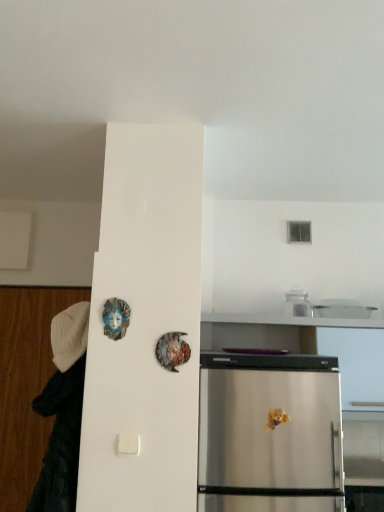
The width and height of the screenshot is (384, 512). What do you see at coordinates (63, 412) in the screenshot? I see `white fabric at left` at bounding box center [63, 412].

Identify the location of white fabric at left. (63, 412).

Image resolution: width=384 pixels, height=512 pixels. What do you see at coordinates (172, 350) in the screenshot? I see `shiny metallic mask at center` at bounding box center [172, 350].

Identify the location of shiny metallic mask at center. (172, 350).

In order to face shiny metallic mask at center, should I rotate leftwards or rightwards?

It's best to rotate left around 2.602 degrees.

Where is `white fabric at left`? white fabric at left is located at coordinates (63, 412).

Which object is positioned more to the left, shiny metallic mask at center or white fabric at left?

From the viewer's perspective, white fabric at left appears more on the left side.

Is shiny metallic mask at center further to the viewer compared to white fabric at left?

No.

Which is behind, point (186, 352) or point (57, 393)?

The point (57, 393) is behind.

From the image's perspective, between shiny metallic mask at center and white fabric at left, who is located below?

white fabric at left is shown below in the image.

From a real-world perspective, relative to white fabric at left, is shiny metallic mask at center vertically above or below?

shiny metallic mask at center is situated higher than white fabric at left in the real world.

Considering the relative sizes of shiny metallic mask at center and white fabric at left in the image provided, is shiny metallic mask at center wider than white fabric at left?

No, shiny metallic mask at center is not wider than white fabric at left.

Is shiny metallic mask at center shorter than white fabric at left?

Yes, shiny metallic mask at center is shorter than white fabric at left.

Does shiny metallic mask at center have a larger size compared to white fabric at left?

Actually, shiny metallic mask at center might be smaller than white fabric at left.

Would you say white fabric at left is part of shiny metallic mask at center's contents?

No, white fabric at left is not surrounded by shiny metallic mask at center.

Is shiny metallic mask at center directly adjacent to white fabric at left?

There is a gap between shiny metallic mask at center and white fabric at left.

Based on the photo, could you tell me if shiny metallic mask at center is facing white fabric at left?

No, shiny metallic mask at center is not turned towards white fabric at left.

Measure the distance between shiny metallic mask at center and white fabric at left.

shiny metallic mask at center is 17.33 inches from white fabric at left.

Identify the location of couple that is below the shiny metallic mask at center (from the image's perspective). (63, 412).

Between white fabric at left and shiny metallic mask at center, which one appears on the right side from the viewer's perspective?

shiny metallic mask at center.

In the image, is white fabric at left positioned in front of or behind shiny metallic mask at center?

In the image, white fabric at left appears behind shiny metallic mask at center.

Is point (62, 464) positioned behind point (171, 341)?

No, it is in front of (171, 341).

From the image's perspective, is white fabric at left above shiny metallic mask at center?

Actually, white fabric at left appears below shiny metallic mask at center in the image.

From a real-world perspective, is white fabric at left located higher than shiny metallic mask at center?

Incorrect, from a real-world perspective, white fabric at left is lower than shiny metallic mask at center.

Does white fabric at left have a greater width compared to shiny metallic mask at center?

Indeed, white fabric at left has a greater width compared to shiny metallic mask at center.

Considering the sizes of white fabric at left and shiny metallic mask at center in the image, is white fabric at left taller or shorter than shiny metallic mask at center?

Considering their sizes, white fabric at left has more height than shiny metallic mask at center.

Can you confirm if white fabric at left is bigger than shiny metallic mask at center?

Indeed, white fabric at left has a larger size compared to shiny metallic mask at center.

Is white fabric at left located outside shiny metallic mask at center?

Yes.

Is white fabric at left in contact with shiny metallic mask at center?

No, white fabric at left is not next to shiny metallic mask at center.

Is white fabric at left aimed at shiny metallic mask at center?

No, white fabric at left is not aimed at shiny metallic mask at center.

What's the angular difference between white fabric at left and shiny metallic mask at center's facing directions?

The angular difference between white fabric at left and shiny metallic mask at center is 1 degrees.

Identify the location of art above the white fabric at left (from a real-world perspective). (172, 350).

You are a GUI agent. You are given a task and a screenshot of the screen. Output one action in this format:
    pyautogui.click(x=<x>, y=<y>)
    Task: Click on the art located above the white fabric at left (from the image's perspective)
    Image resolution: width=384 pixels, height=512 pixels.
    Given the screenshot: What is the action you would take?
    pyautogui.click(x=172, y=350)

Where is `couple lying on the left of shiny metallic mask at center`? This screenshot has width=384, height=512. couple lying on the left of shiny metallic mask at center is located at coordinates (63, 412).